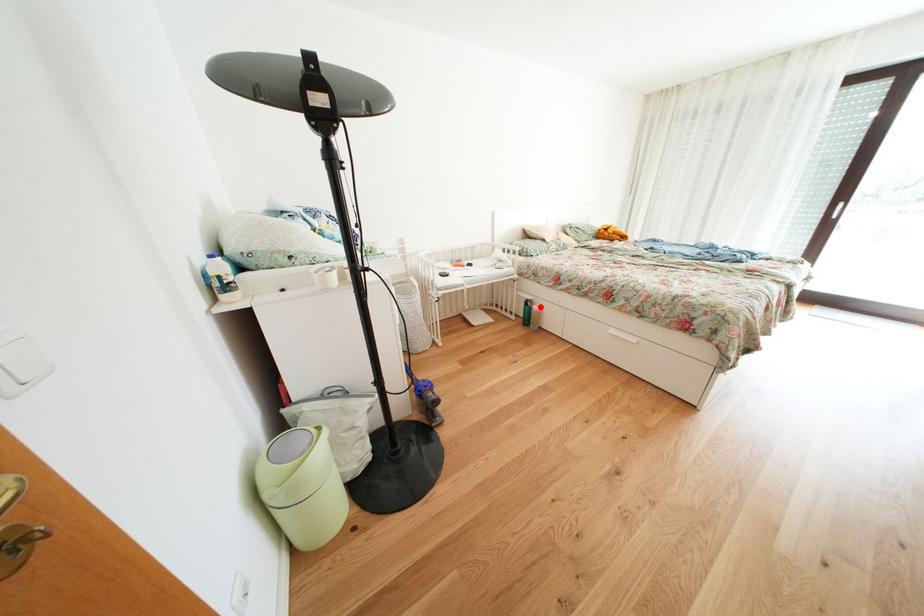
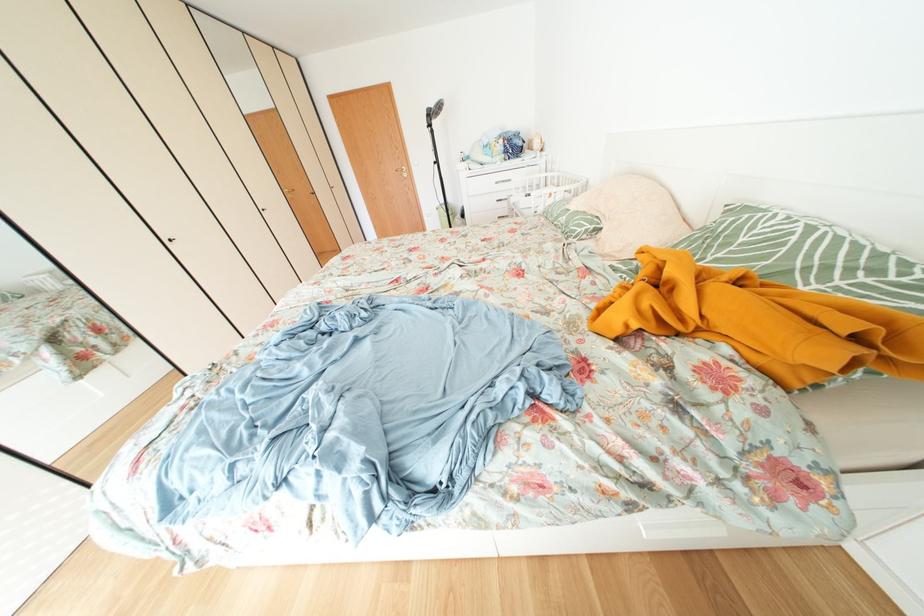
Question: I am providing you with two images of the same scene from different viewpoints. A red point is marked on the first image. Is the red point's position out of view in image 2?

Choices:
 (A) Yes
 (B) No

Answer: (A)